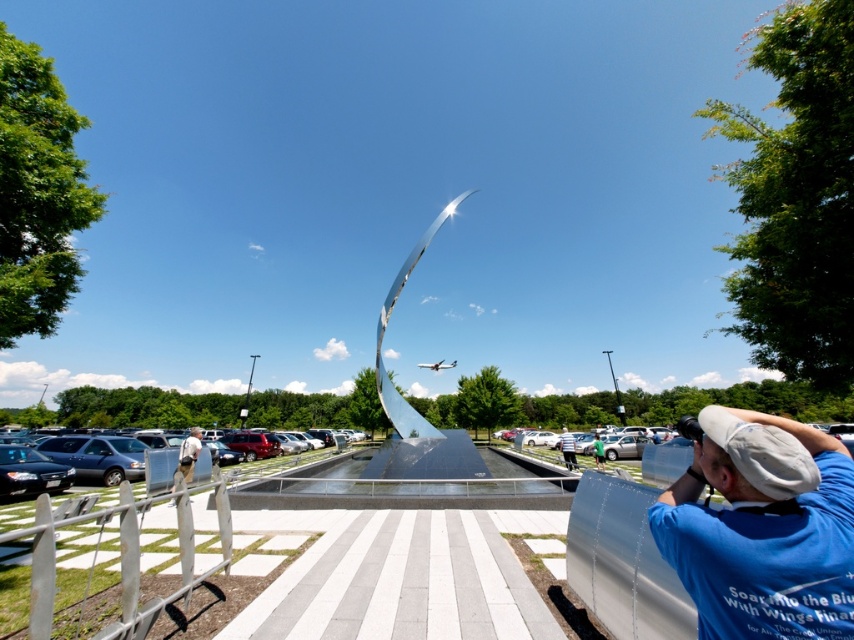
Question: In this image, where is matte black sedan at lower left located relative to white cotton shirt at center?

Choices:
 (A) above
 (B) below

Answer: (A)

Question: Which object is closer to the camera taking this photo?

Choices:
 (A) green t-shirt at lower right
 (B) matte black sedan at lower left
 (C) khaki cotton pants at lower left

Answer: (C)

Question: Does khaki cotton pants at lower left have a lesser width compared to white cotton shirt at center?

Choices:
 (A) yes
 (B) no

Answer: (B)

Question: Estimate the real-world distances between objects in this image. Which object is farther from the green t-shirt at lower right?

Choices:
 (A) matte black sedan at lower left
 (B) white cotton shirt at center

Answer: (A)

Question: Does blue cotton shirt at lower right appear on the left side of khaki cotton pants at lower left?

Choices:
 (A) no
 (B) yes

Answer: (A)

Question: Which point is farther from the camera taking this photo?

Choices:
 (A) (184, 449)
 (B) (600, 452)

Answer: (B)